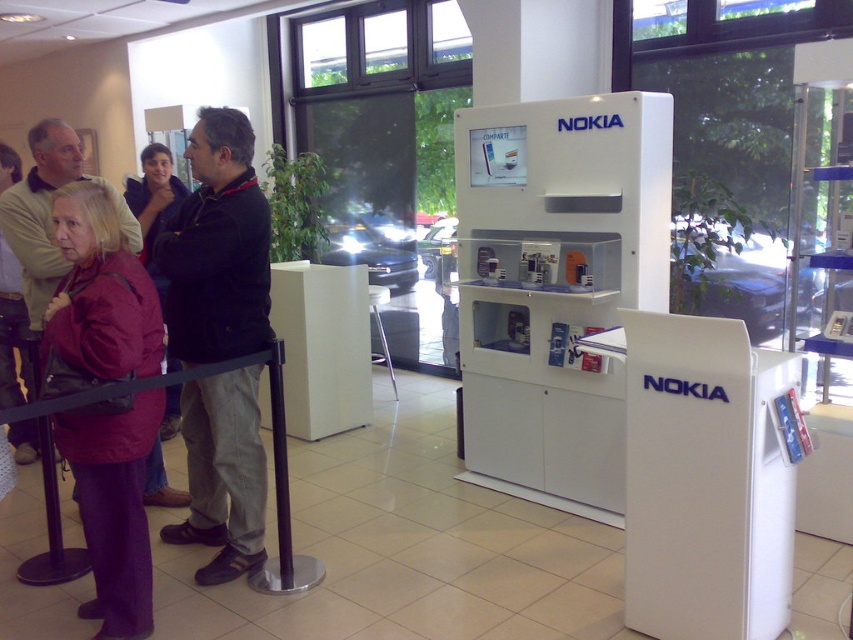
Question: Which object appears closest to the camera in this image?

Choices:
 (A) dark gray fabric jacket at left
 (B) matte red jacket at left

Answer: (A)

Question: Among these objects, which one is nearest to the camera?

Choices:
 (A) maroon fabric jacket at left
 (B) dark gray fabric jacket at left
 (C) matte red jacket at left
 (D) dark gray jacket at center

Answer: (A)

Question: Can you confirm if dark gray jacket at center is positioned to the left of matte red jacket at left?

Choices:
 (A) no
 (B) yes

Answer: (A)

Question: Among these points, which one is farthest from the camera?

Choices:
 (A) (262, 214)
 (B) (25, 285)
 (C) (114, 605)

Answer: (B)

Question: Is dark gray fabric jacket at left below matte red jacket at left?

Choices:
 (A) yes
 (B) no

Answer: (A)

Question: Does dark gray fabric jacket at left come behind matte red jacket at left?

Choices:
 (A) yes
 (B) no

Answer: (B)